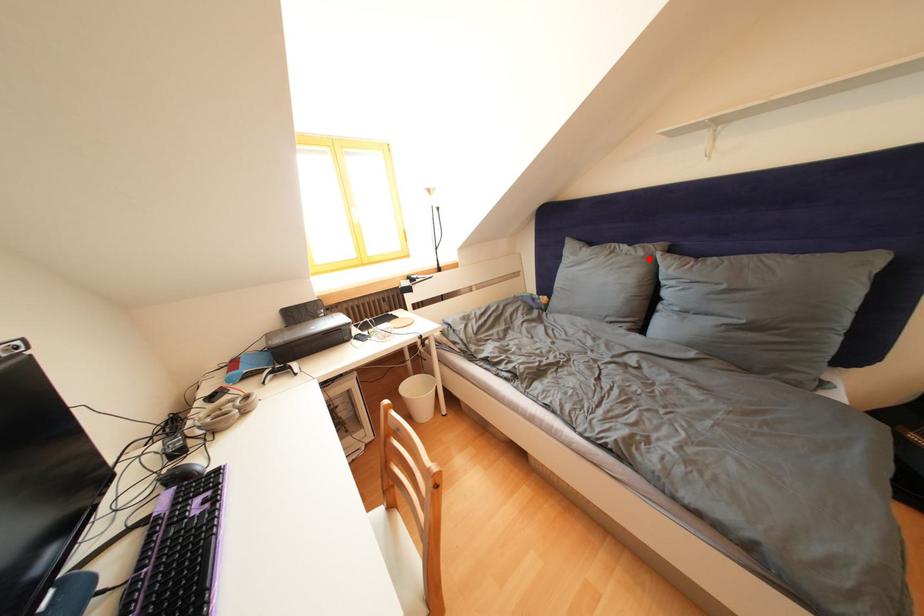
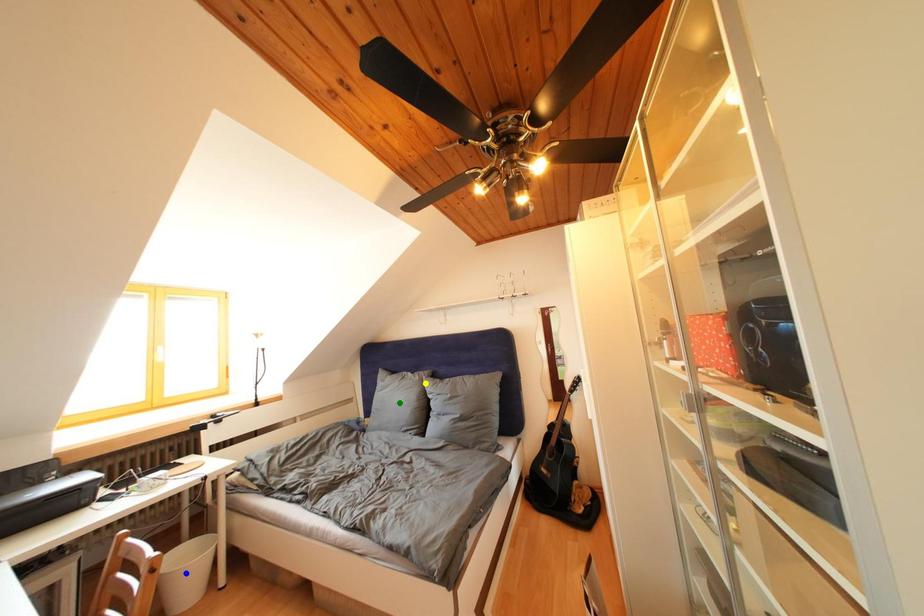
Question: I am providing you with two images of the same scene from different viewpoints. A red point is marked on the first image. You are given multiple points on the second image. Can you choose the point in image 2 that corresponds to the point in image 1?

Choices:
 (A) yellow point
 (B) green point
 (C) blue point

Answer: (A)